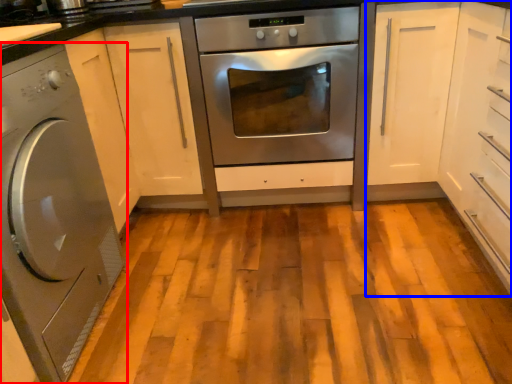
Question: Which object appears closest to the camera in this image, washing machine (highlighted by a red box) or cabinetry (highlighted by a blue box)?

Choices:
 (A) washing machine
 (B) cabinetry

Answer: (A)